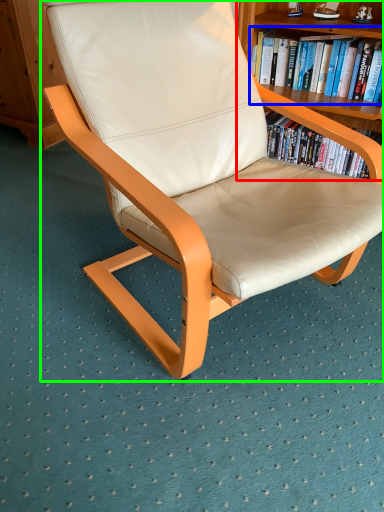
Question: Which object is the closest to the bookcase (highlighted by a red box)? Choose among these: book (highlighted by a blue box) or chair (highlighted by a green box).

Choices:
 (A) book
 (B) chair

Answer: (A)